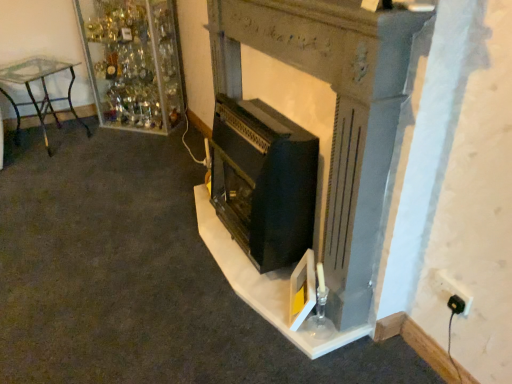
Question: Is black plastic plug at lower right a part of clear glass shelves at upper left?

Choices:
 (A) yes
 (B) no

Answer: (B)

Question: Is clear glass shelves at upper left bigger than black plastic plug at lower right?

Choices:
 (A) yes
 (B) no

Answer: (A)

Question: From the image's perspective, is clear glass shelves at upper left under black plastic plug at lower right?

Choices:
 (A) no
 (B) yes

Answer: (A)

Question: Does clear glass shelves at upper left have a lesser height compared to black plastic plug at lower right?

Choices:
 (A) no
 (B) yes

Answer: (A)

Question: Is clear glass shelves at upper left not close to black plastic plug at lower right?

Choices:
 (A) yes
 (B) no

Answer: (A)

Question: Are clear glass shelves at upper left and black plastic plug at lower right making contact?

Choices:
 (A) no
 (B) yes

Answer: (A)

Question: From the image's perspective, is white plastic plug at lower right below clear glass shelves at upper left?

Choices:
 (A) no
 (B) yes

Answer: (B)

Question: Is white plastic plug at lower right not close to clear glass shelves at upper left?

Choices:
 (A) yes
 (B) no

Answer: (A)

Question: Considering the relative sizes of white plastic plug at lower right and clear glass shelves at upper left in the image provided, is white plastic plug at lower right shorter than clear glass shelves at upper left?

Choices:
 (A) yes
 (B) no

Answer: (A)

Question: Is white plastic plug at lower right outside clear glass shelves at upper left?

Choices:
 (A) yes
 (B) no

Answer: (A)

Question: From a real-world perspective, is white plastic plug at lower right on clear glass shelves at upper left?

Choices:
 (A) yes
 (B) no

Answer: (B)

Question: From a real-world perspective, is white plastic plug at lower right positioned under clear glass shelves at upper left based on gravity?

Choices:
 (A) no
 (B) yes

Answer: (B)

Question: Does black plastic plug at lower right have a greater height compared to white plastic plug at lower right?

Choices:
 (A) no
 (B) yes

Answer: (A)